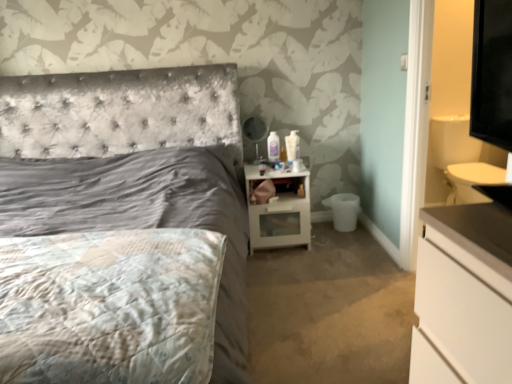
Question: Does white glossy nightstand at center have a greater height compared to matte black mirror at upper right?

Choices:
 (A) yes
 (B) no

Answer: (A)

Question: From the image's perspective, would you say white glossy nightstand at center is positioned over matte black mirror at upper right?

Choices:
 (A) no
 (B) yes

Answer: (A)

Question: Is white glossy nightstand at center wider than matte black mirror at upper right?

Choices:
 (A) yes
 (B) no

Answer: (A)

Question: Is white glossy nightstand at center outside of matte black mirror at upper right?

Choices:
 (A) yes
 (B) no

Answer: (A)

Question: Is white glossy nightstand at center to the right of matte black mirror at upper right from the viewer's perspective?

Choices:
 (A) yes
 (B) no

Answer: (A)

Question: Is white glossy nightstand at center closer to camera compared to matte black mirror at upper right?

Choices:
 (A) no
 (B) yes

Answer: (B)

Question: Is white glossy lotion at upper center behind white glossy nightstand at center?

Choices:
 (A) no
 (B) yes

Answer: (B)

Question: Does white glossy lotion at upper center have a larger size compared to white glossy nightstand at center?

Choices:
 (A) no
 (B) yes

Answer: (A)

Question: Considering the relative sizes of white glossy lotion at upper center and white glossy nightstand at center in the image provided, is white glossy lotion at upper center taller than white glossy nightstand at center?

Choices:
 (A) no
 (B) yes

Answer: (A)

Question: From a real-world perspective, is white glossy lotion at upper center below white glossy nightstand at center?

Choices:
 (A) yes
 (B) no

Answer: (B)

Question: Is white glossy lotion at upper center at the left side of white glossy nightstand at center?

Choices:
 (A) yes
 (B) no

Answer: (B)

Question: Does white glossy lotion at upper center appear on the right side of white glossy nightstand at center?

Choices:
 (A) yes
 (B) no

Answer: (A)

Question: Is satin gray bed at center located within white glossy lotion at upper center?

Choices:
 (A) yes
 (B) no

Answer: (B)